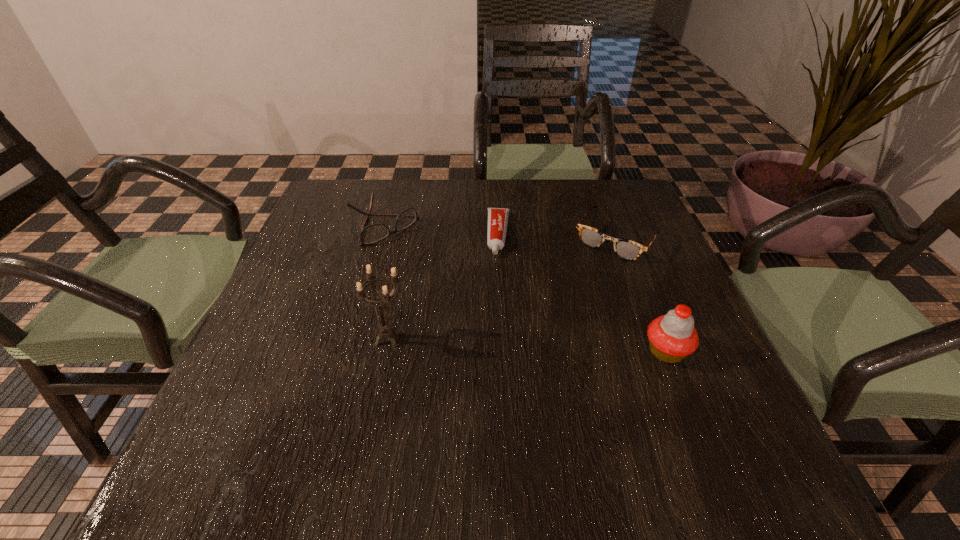
The width and height of the screenshot is (960, 540). In order to click on the tallest object in this screenshot , I will do `click(386, 330)`.

The image size is (960, 540). In order to click on cupcake in this screenshot , I will do `click(672, 337)`.

Where is `the left spectacles`? the left spectacles is located at coordinates (373, 233).

Identify the location of the right spectacles. This screenshot has width=960, height=540. (625, 249).

Find the location of a particular element. Image resolution: width=960 pixels, height=540 pixels. the third object from left to right is located at coordinates (497, 217).

You are a GUI agent. You are given a task and a screenshot of the screen. Output one action in this format:
    pyautogui.click(x=<x>, y=<y>)
    Task: Click on the toothpaste
    This screenshot has width=960, height=540.
    Given the screenshot: What is the action you would take?
    pyautogui.click(x=497, y=217)

Find the location of `free spot located on the front of the candle holder`. free spot located on the front of the candle holder is located at coordinates (379, 388).

At what (x,y) coordinates should I click in order to perform the action: click on free spot located on the back of the cupcake. Please return your answer as a coordinate pair (x, y). Looking at the image, I should click on (623, 243).

At what (x,y) coordinates should I click in order to perform the action: click on free space located 0.210m on the front-facing side of the left spectacles. Please return your answer as a coordinate pair (x, y). Looking at the image, I should click on (455, 285).

This screenshot has width=960, height=540. What are the coordinates of `free space located 0.270m on the front-facing side of the left spectacles` in the screenshot? It's located at (472, 299).